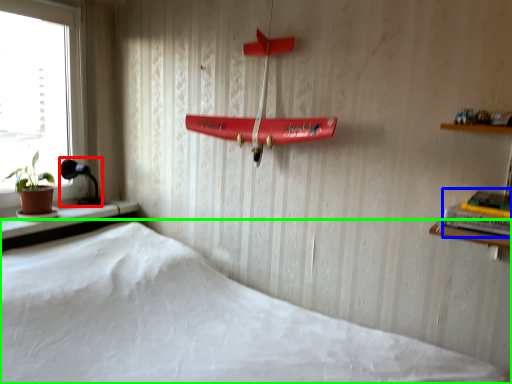
Question: Which is farther away from lamp (highlighted by a red box)? book (highlighted by a blue box) or bed (highlighted by a green box)?

Choices:
 (A) book
 (B) bed

Answer: (A)